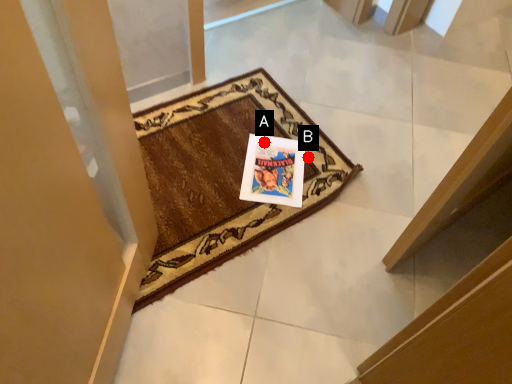
Question: Two points are circled on the image, labeled by A and B beside each circle. Which point is farther from the camera taking this photo?

Choices:
 (A) A is further
 (B) B is further

Answer: (A)